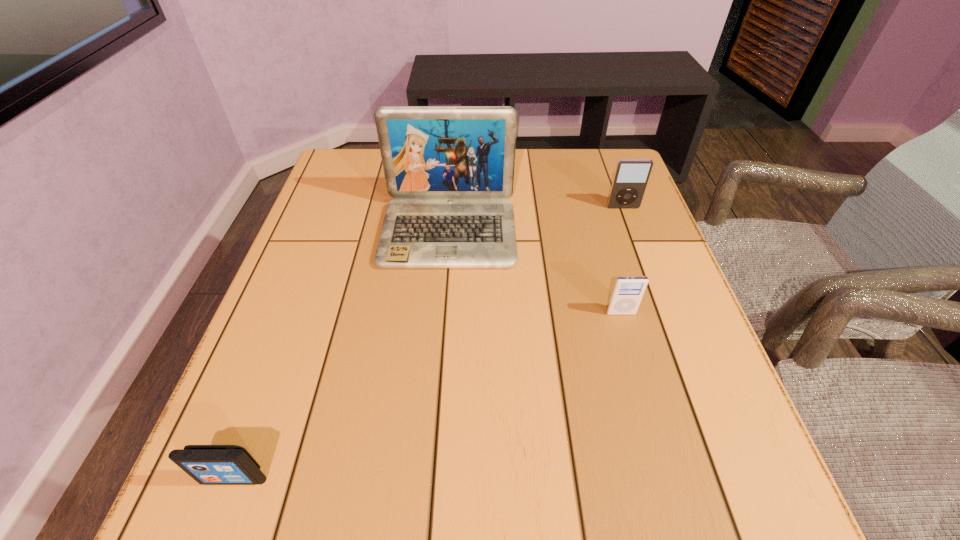
Image resolution: width=960 pixels, height=540 pixels. I want to click on the third object from right to left, so click(x=449, y=168).

Locate an element on the screen. the tallest object is located at coordinates (449, 168).

Where is `the rightmost object`? This screenshot has height=540, width=960. the rightmost object is located at coordinates (631, 176).

Find the location of `the rightmost iPod`. the rightmost iPod is located at coordinates (631, 176).

At what (x,y) coordinates should I click in order to perform the action: click on the third object from left to right. Please return your answer as a coordinate pair (x, y). The height and width of the screenshot is (540, 960). Looking at the image, I should click on (627, 292).

The image size is (960, 540). What are the coordinates of `the second nearest iPod` in the screenshot? It's located at click(x=627, y=292).

Where is `the nearest iPod`? This screenshot has width=960, height=540. the nearest iPod is located at coordinates (207, 464).

The height and width of the screenshot is (540, 960). Find the location of `the leftmost object`. the leftmost object is located at coordinates (207, 464).

Where is `vacant space located on the screen of the tallest object`? The height and width of the screenshot is (540, 960). vacant space located on the screen of the tallest object is located at coordinates (441, 342).

Locate an element on the screen. The image size is (960, 540). vacant space located 0.120m on the front-facing side of the tallest iPod is located at coordinates (636, 240).